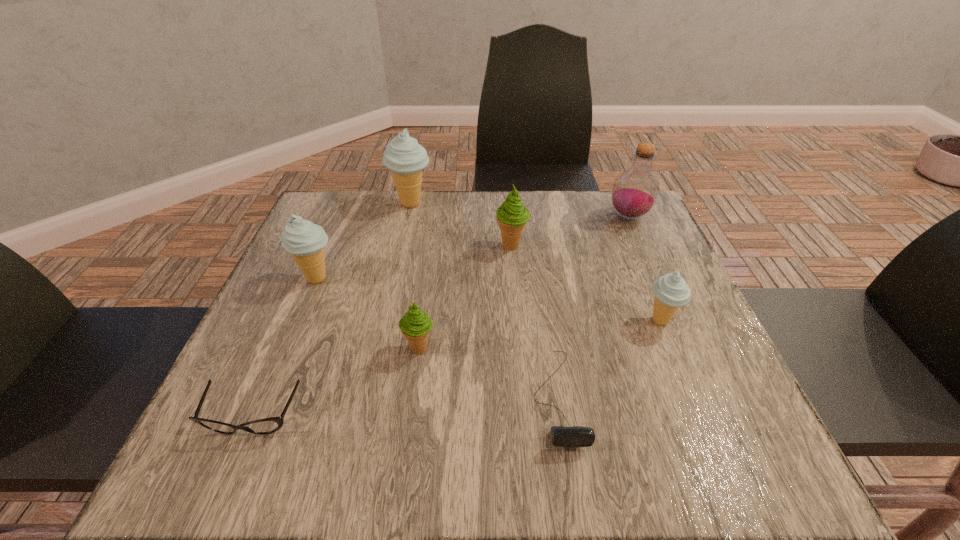
The width and height of the screenshot is (960, 540). What are the coordinates of `vacant space at the right edge` in the screenshot? It's located at (743, 407).

You are a GUI agent. You are given a task and a screenshot of the screen. Output one action in this format:
    pyautogui.click(x=<x>, y=<y>)
    Task: Click on the vacant region at the far left corner of the desktop
    
    Given the screenshot: What is the action you would take?
    pyautogui.click(x=326, y=205)

Where is `free space at the far right corner of the desktop`? This screenshot has width=960, height=540. free space at the far right corner of the desktop is located at coordinates (588, 205).

You are a GUI agent. You are given a task and a screenshot of the screen. Output one action in this format:
    pyautogui.click(x=<x>, y=<y>)
    Task: Click on the free spot between the webcam and the second farthest beige icecream
    This screenshot has height=540, width=960.
    Given the screenshot: What is the action you would take?
    pyautogui.click(x=437, y=338)

Where is `free space between the smaller green icecream and the bottle`? The image size is (960, 540). free space between the smaller green icecream and the bottle is located at coordinates (524, 282).

At what (x,y) coordinates should I click in order to perform the action: click on free space between the nearest icecream and the fourth farthest icecream. Please return your answer as a coordinate pair (x, y). This screenshot has height=540, width=960. Looking at the image, I should click on (540, 334).

You are a GUI agent. You are given a task and a screenshot of the screen. Output one action in this format:
    pyautogui.click(x=<x>, y=<y>)
    Task: Click on the vacant point located between the sixth nearest object and the fifth nearest object
    The width and height of the screenshot is (960, 540).
    Given the screenshot: What is the action you would take?
    pyautogui.click(x=414, y=262)

Where is `free space between the fifth farthest object and the purple bottle`? free space between the fifth farthest object and the purple bottle is located at coordinates (644, 268).

Identify the location of vacant area between the second beige icecream from left to right and the rightmost icecream. The image size is (960, 540). (536, 262).

Find the location of `empty space that is in between the nearer green icecream and the bottle`. empty space that is in between the nearer green icecream and the bottle is located at coordinates (524, 282).